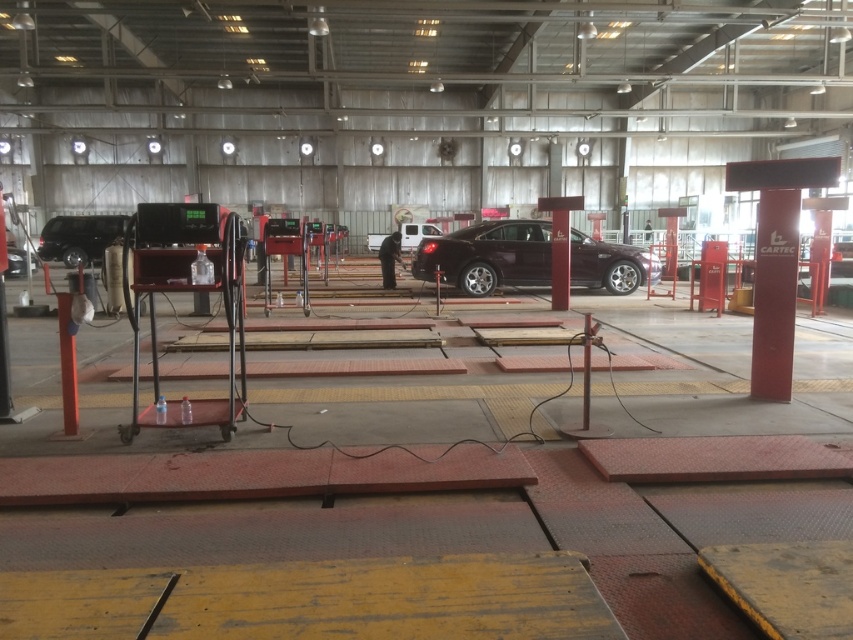
Looking at this image, you are a mechanic working in the repair facility and need to move the shiny black car at left. Which direction should you move it to avoid blocking the white matte van at center?

The shiny black car at left is positioned on the left side of the white matte van at center. To avoid blocking it, you should move the shiny black car at left to the right side of the white matte van at center.

What is located at the point with coordinates (79, 237)?

The point at (79, 237) is where the shiny black car at left is located.

You are a mechanic working in the automotive repair facility. You need to move a tool from the red hydraulic lift at the far left to the satin burgundy car at center. Which direction should you move relative to the red hydraulic lift at the far left?

The satin burgundy car at center is located at point (488, 256), so you should move towards the right and forward relative to the red hydraulic lift at the far left.